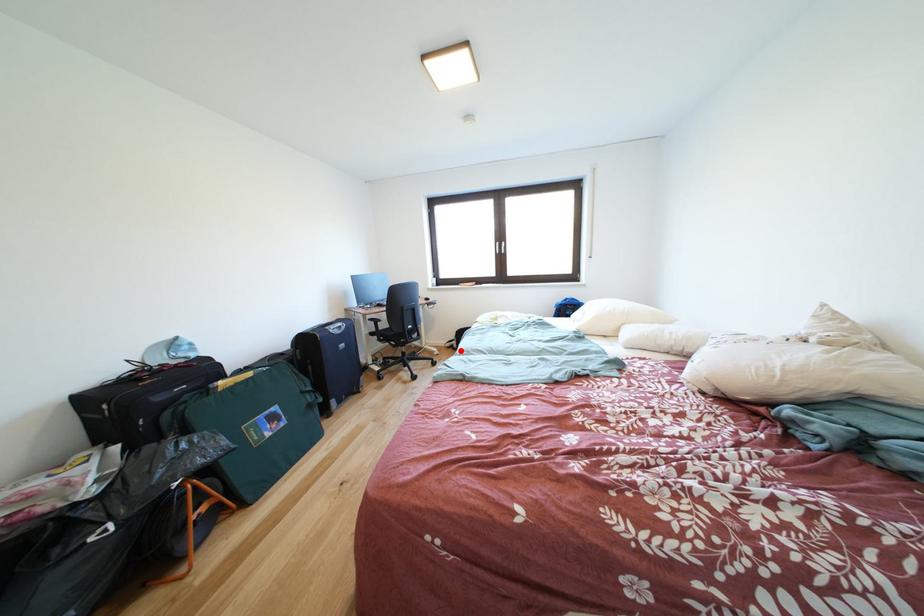
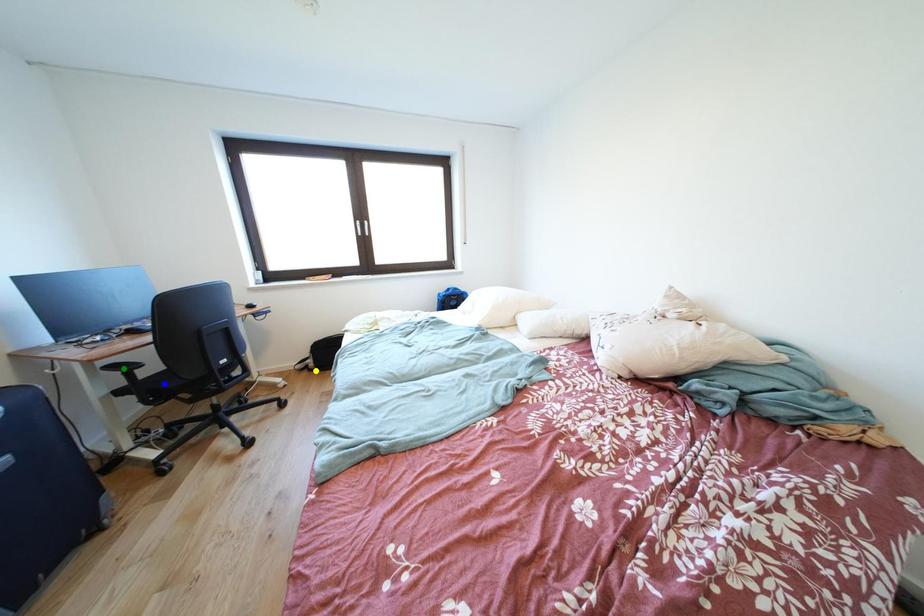
Question: I am providing you with two images of the same scene from different viewpoints. A red point is marked on the first image. You are given multiple points on the second image. Can you choose the point in image 2 that corresponds to the point in image 1?

Choices:
 (A) yellow point
 (B) green point
 (C) blue point

Answer: (A)